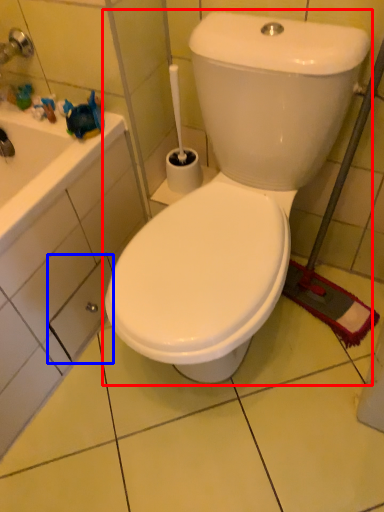
Question: Among these objects, which one is nearest to the camera, toilet (highlighted by a red box) or drawer (highlighted by a blue box)?

Choices:
 (A) toilet
 (B) drawer

Answer: (A)